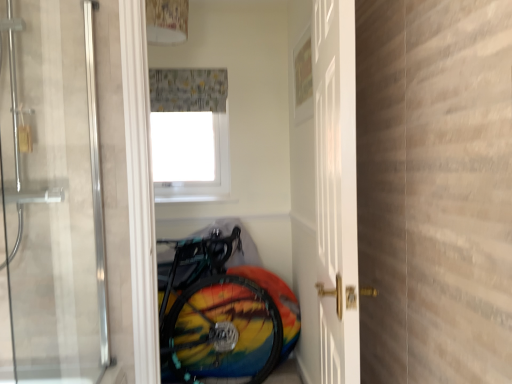
Question: Could you tell me if white matte window screen at upper center is facing white glossy door at center, which is the first door from right to left?

Choices:
 (A) no
 (B) yes

Answer: (B)

Question: Is white matte window screen at upper center closer to camera compared to white glossy door at center, which is counted as the second door, starting from the left?

Choices:
 (A) yes
 (B) no

Answer: (B)

Question: From the image's perspective, does white matte window screen at upper center appear higher than white glossy door at center, which is the first door from right to left?

Choices:
 (A) no
 (B) yes

Answer: (B)

Question: From a real-world perspective, is white matte window screen at upper center positioned over white glossy door at center, which is the first door from right to left, based on gravity?

Choices:
 (A) no
 (B) yes

Answer: (B)

Question: Is white glossy door at center, which is counted as the second door, starting from the left, at the back of white matte window screen at upper center?

Choices:
 (A) no
 (B) yes

Answer: (A)

Question: Is the position of white matte window screen at upper center more distant than that of white glossy door at center, which is the first door from right to left?

Choices:
 (A) yes
 (B) no

Answer: (A)

Question: Considering the relative sizes of transparent glass door at center, positioned as the 1th door in left-to-right order, and rainbow painted tire at lower center in the image provided, is transparent glass door at center, positioned as the 1th door in left-to-right order, taller than rainbow painted tire at lower center?

Choices:
 (A) yes
 (B) no

Answer: (A)

Question: Is transparent glass door at center, the second door when ordered from right to left, to the left of rainbow painted tire at lower center from the viewer's perspective?

Choices:
 (A) no
 (B) yes

Answer: (B)

Question: Could you tell me if transparent glass door at center, the second door when ordered from right to left, is facing rainbow painted tire at lower center?

Choices:
 (A) yes
 (B) no

Answer: (B)

Question: Is transparent glass door at center, positioned as the 1th door in left-to-right order, in front of rainbow painted tire at lower center?

Choices:
 (A) no
 (B) yes

Answer: (B)

Question: Is transparent glass door at center, positioned as the 1th door in left-to-right order, thinner than rainbow painted tire at lower center?

Choices:
 (A) yes
 (B) no

Answer: (A)

Question: From the image's perspective, is transparent glass door at center, the second door when ordered from right to left, over rainbow painted tire at lower center?

Choices:
 (A) no
 (B) yes

Answer: (B)

Question: From the image's perspective, does printed fabric shower curtain at upper center appear lower than rainbow painted tire at lower center?

Choices:
 (A) no
 (B) yes

Answer: (A)